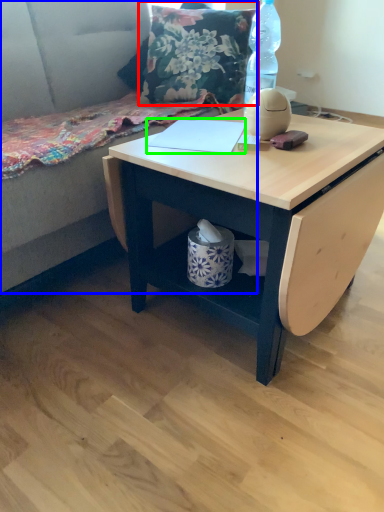
Question: Based on their relative distances, which object is nearer to throw pillow (highlighted by a red box)? Choose from couch (highlighted by a blue box) and notebook (highlighted by a green box).

Choices:
 (A) couch
 (B) notebook

Answer: (A)